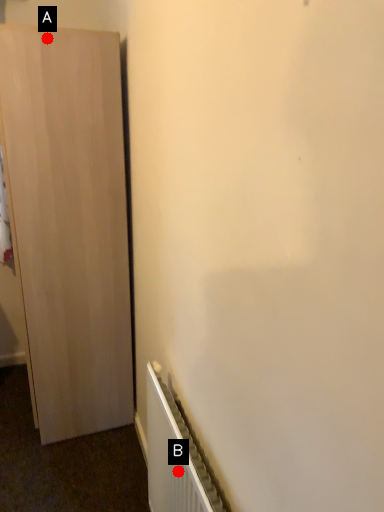
Question: Two points are circled on the image, labeled by A and B beside each circle. Which of the following is the farthest from the observer?

Choices:
 (A) A is further
 (B) B is further

Answer: (A)